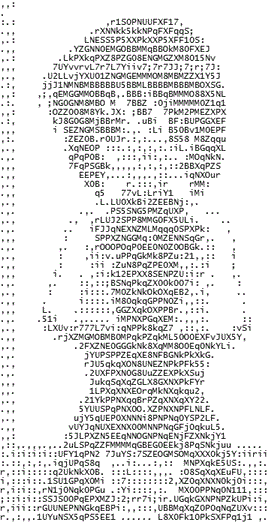
Find the location of a particular element. Image resolution: width=268 pixels, height=522 pixels. column on left is located at coordinates (6, 41).